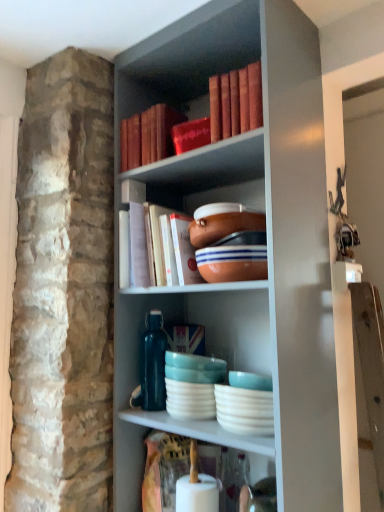
Question: Would you say matte orange bowl at center, positioned as the 2th bowl in top-to-bottom order, is part of matte orange bowl at center, positioned as the 2th bowl in bottom-to-top order,'s contents?

Choices:
 (A) yes
 (B) no

Answer: (B)

Question: Is matte orange bowl at center, the 1th bowl positioned from the top, thinner than matte orange bowl at center, positioned as the 2th bowl in top-to-bottom order?

Choices:
 (A) no
 (B) yes

Answer: (B)

Question: Considering the relative sizes of matte orange bowl at center, positioned as the 2th bowl in bottom-to-top order, and matte orange bowl at center, positioned as the 2th bowl in top-to-bottom order, in the image provided, is matte orange bowl at center, positioned as the 2th bowl in bottom-to-top order, bigger than matte orange bowl at center, positioned as the 2th bowl in top-to-bottom order,?

Choices:
 (A) no
 (B) yes

Answer: (A)

Question: Is matte orange bowl at center, the 1th bowl positioned from the top, to the left of matte orange bowl at center, positioned as the 2th bowl in top-to-bottom order, from the viewer's perspective?

Choices:
 (A) no
 (B) yes

Answer: (B)

Question: Could you tell me if matte orange bowl at center, the 1th bowl positioned from the top, is facing matte orange bowl at center, positioned as the 1th bowl in bottom-to-top order?

Choices:
 (A) no
 (B) yes

Answer: (A)

Question: Is matte orange bowl at center, positioned as the 2th bowl in bottom-to-top order, touching matte orange bowl at center, positioned as the 2th bowl in top-to-bottom order?

Choices:
 (A) no
 (B) yes

Answer: (B)

Question: From a real-world perspective, is matte orange bowl at center, positioned as the 1th bowl in bottom-to-top order, positioned under matte orange bowl at center, the 1th bowl positioned from the top, based on gravity?

Choices:
 (A) yes
 (B) no

Answer: (A)

Question: Is matte orange bowl at center, positioned as the 1th bowl in bottom-to-top order, positioned beyond the bounds of matte orange bowl at center, the 1th bowl positioned from the top?

Choices:
 (A) no
 (B) yes

Answer: (B)

Question: Is matte orange bowl at center, positioned as the 2th bowl in top-to-bottom order, to the left of matte orange bowl at center, positioned as the 2th bowl in bottom-to-top order, from the viewer's perspective?

Choices:
 (A) no
 (B) yes

Answer: (A)

Question: Is matte orange bowl at center, positioned as the 1th bowl in bottom-to-top order, turned away from matte orange bowl at center, positioned as the 2th bowl in bottom-to-top order?

Choices:
 (A) no
 (B) yes

Answer: (A)

Question: Can you confirm if matte orange bowl at center, positioned as the 1th bowl in bottom-to-top order, is taller than matte orange bowl at center, positioned as the 2th bowl in bottom-to-top order?

Choices:
 (A) yes
 (B) no

Answer: (A)

Question: Does matte orange bowl at center, positioned as the 2th bowl in top-to-bottom order, lie in front of matte orange bowl at center, positioned as the 2th bowl in bottom-to-top order?

Choices:
 (A) no
 (B) yes

Answer: (B)

Question: Is the depth of matte orange bowl at center, positioned as the 2th bowl in top-to-bottom order, less than that of hardcover book at center, the second book positioned from the top?

Choices:
 (A) no
 (B) yes

Answer: (B)